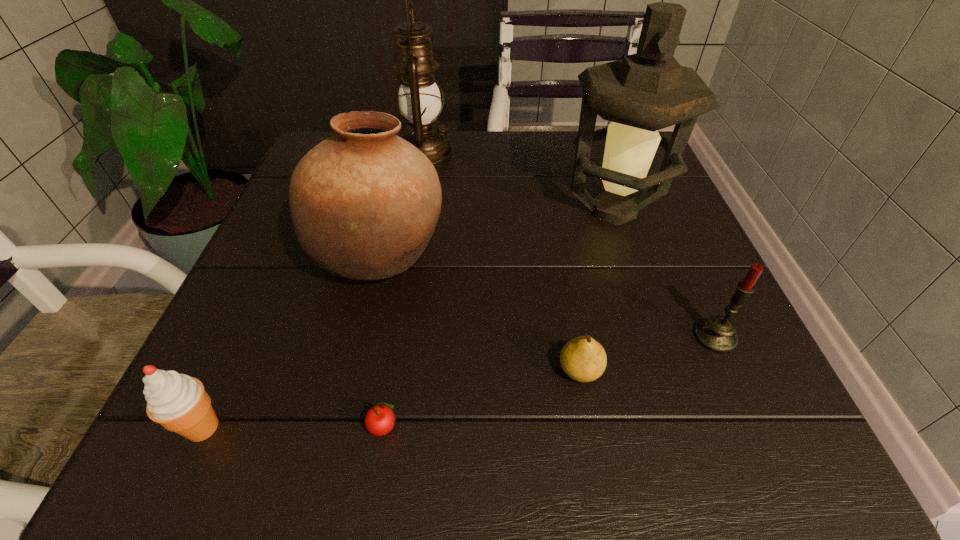
The image size is (960, 540). I want to click on vacant region located on the back of the fifth shortest object, so click(x=407, y=143).

The image size is (960, 540). What are the coordinates of `vacant position located 0.230m on the left of the candle` in the screenshot? It's located at (546, 338).

Locate an element on the screen. The image size is (960, 540). vacant region located 0.080m on the right of the leftmost object is located at coordinates (287, 427).

Identify the location of vacant space located 0.060m on the left of the pear. (516, 370).

Identify the location of free location located on the back of the cherry. The height and width of the screenshot is (540, 960). (406, 298).

Locate an element on the screen. The height and width of the screenshot is (540, 960). icecream located at the near edge is located at coordinates (178, 402).

At what (x,y) coordinates should I click in order to perform the action: click on cherry located in the near edge section of the desktop. Please return your answer as a coordinate pair (x, y). Image resolution: width=960 pixels, height=540 pixels. Looking at the image, I should click on (380, 419).

You are a GUI agent. You are given a task and a screenshot of the screen. Output one action in this format:
    pyautogui.click(x=<x>, y=<y>)
    Task: Click on the pottery at the left edge
    
    Given the screenshot: What is the action you would take?
    pyautogui.click(x=364, y=203)

Where is `icecream that is at the left edge`? This screenshot has height=540, width=960. icecream that is at the left edge is located at coordinates (178, 402).

What are the coordinates of `oil lamp at the right edge` in the screenshot? It's located at (644, 92).